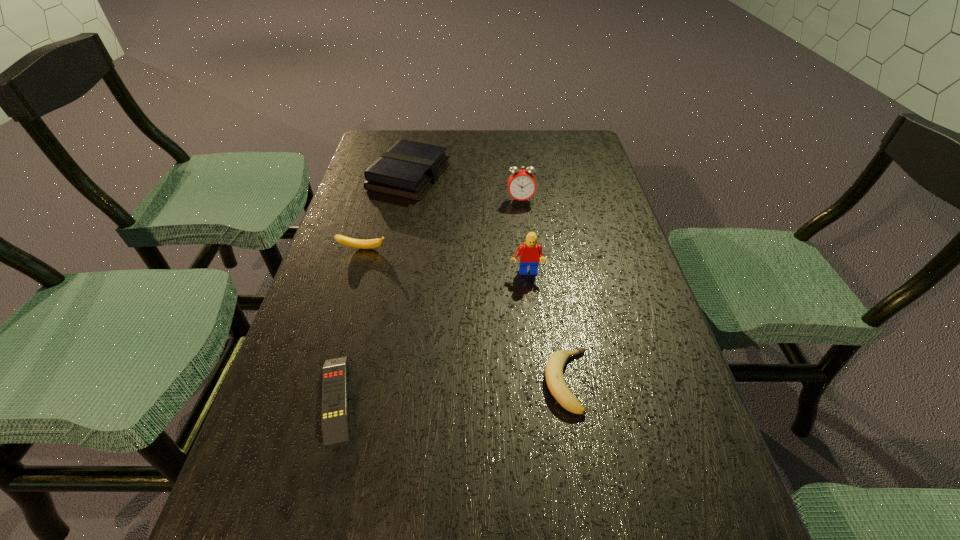
The height and width of the screenshot is (540, 960). Identify the location of free space at the left edge. (374, 237).

In the image, there is a desktop. Where is `vacant space at the right edge`? Image resolution: width=960 pixels, height=540 pixels. vacant space at the right edge is located at coordinates (664, 325).

In the image, there is a desktop. Where is `vacant space at the far left corner`? The image size is (960, 540). vacant space at the far left corner is located at coordinates (385, 142).

Identify the location of blank region between the taller banana and the alarm clock. (442, 225).

Identify the location of vacant space in between the remote control and the alarm clock. This screenshot has width=960, height=540. (428, 299).

Where is `vacant space that's between the remote control and the book`? Image resolution: width=960 pixels, height=540 pixels. vacant space that's between the remote control and the book is located at coordinates (372, 287).

In order to click on free spot between the fourth shortest object and the alarm clock in this screenshot , I will do tap(465, 188).

At what (x,y) coordinates should I click in order to perform the action: click on free space between the shortest object and the Lego. Please return your answer as a coordinate pair (x, y). The height and width of the screenshot is (540, 960). Looking at the image, I should click on (431, 336).

At what (x,y) coordinates should I click in order to perform the action: click on blank region between the remote control and the Lego. Please return your answer as a coordinate pair (x, y). This screenshot has width=960, height=540. Looking at the image, I should click on (431, 336).

Where is `free point between the fifth tallest object and the shortest object`? free point between the fifth tallest object and the shortest object is located at coordinates (452, 389).